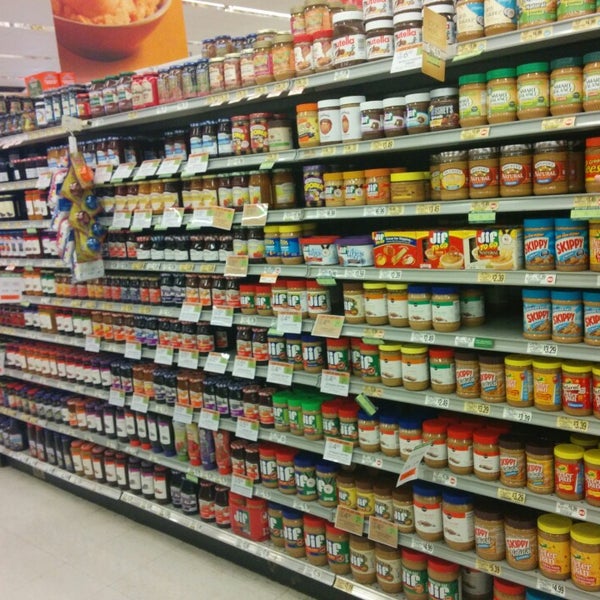
This screenshot has width=600, height=600. What are the coordinates of `ceiling` in the screenshot? It's located at (17, 35), (227, 20).